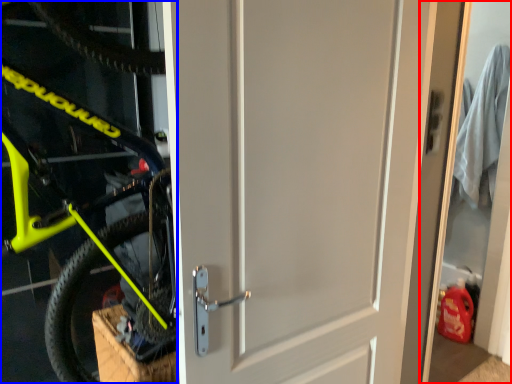
Question: Which point is further to the camera, garage door (highlighted by a red box) or bicycle (highlighted by a blue box)?

Choices:
 (A) garage door
 (B) bicycle

Answer: (A)